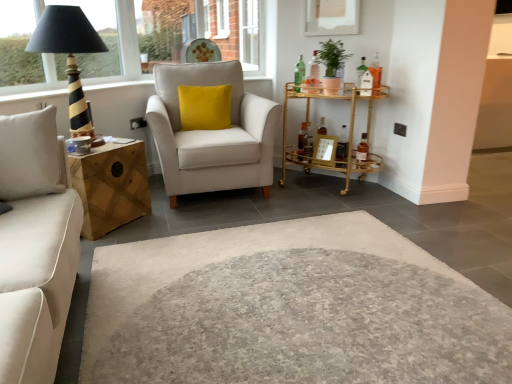
Question: Is point (355, 158) positioned closer to the camera than point (250, 34)?

Choices:
 (A) farther
 (B) closer

Answer: (B)

Question: In the image, is gold metallic bar cart at right on the left side or the right side of white glass window frame at upper center, placed as the second window frame when sorted from front to back?

Choices:
 (A) right
 (B) left

Answer: (A)

Question: Considering the real-world distances, which object is closest to the light beige fabric armchair at center?

Choices:
 (A) striped wood table lamp at left
 (B) gold metallic bar cart at right
 (C) green matte plant at upper right
 (D) clear glass window at upper center
 (E) black plastic lampshade at upper left, acting as the 2th window frame starting from the back

Answer: (B)

Question: Based on their relative distances, which object is nearer to the woodenwoodennightstand at left?

Choices:
 (A) yellow velvet pillow at center
 (B) wooden picture frame at center
 (C) black plastic lampshade at upper left, acting as the 2th window frame starting from the back
 (D) clear glass window at upper center
 (E) gold metallic bar cart at right

Answer: (A)